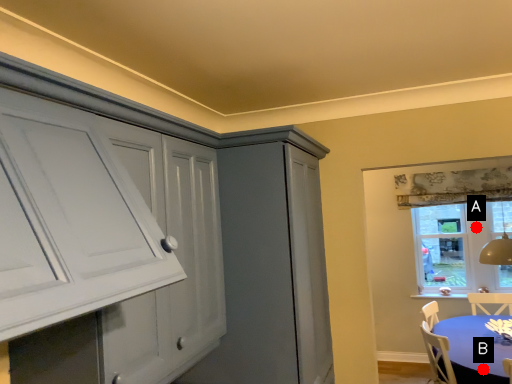
Question: Two points are circled on the image, labeled by A and B beside each circle. Among these points, which one is farthest from the camera?

Choices:
 (A) A is further
 (B) B is further

Answer: (A)